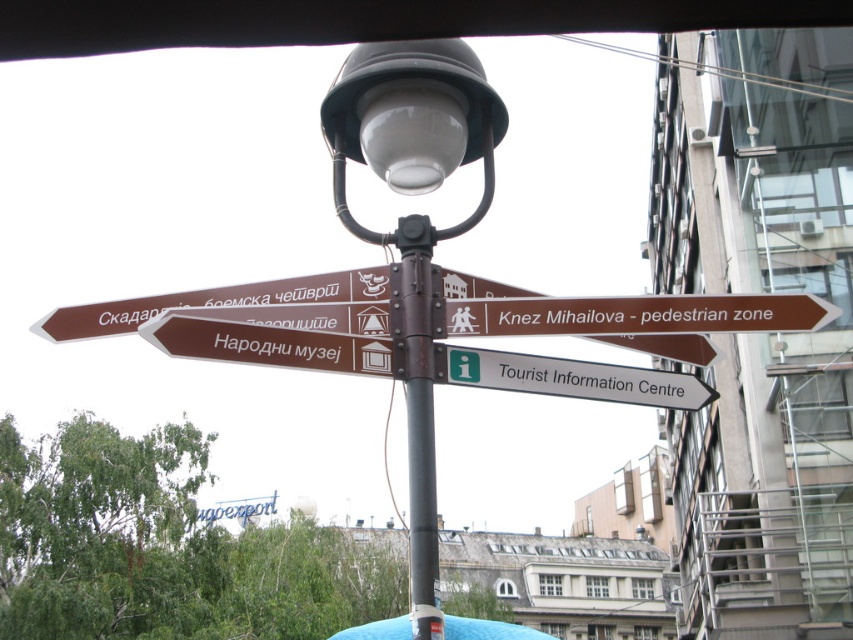
Between point (409, 216) and point (619, 381), which one is positioned behind?

Positioned behind is point (619, 381).

Who is more distant from viewer, (427, 253) or (573, 387)?

The point (573, 387) is behind.

Where is `brown metallic pole at center`? brown metallic pole at center is located at coordinates (421, 417).

What do you see at coordinates (415, 227) in the screenshot?
I see `matte black lamp post at center` at bounding box center [415, 227].

Can you confirm if matte black lamp post at center is shorter than white plastic sign at center?

In fact, matte black lamp post at center may be taller than white plastic sign at center.

Between point (459, 81) and point (646, 400), which one is positioned in front?

Point (459, 81) is more forward.

Find the location of a particular element. matte black lamp post at center is located at coordinates (415, 227).

Who is lower down, matte black lamp post at center or brown metallic pole at center?

brown metallic pole at center is below.

Is matte black lamp post at center taller than brown metallic pole at center?

Correct, matte black lamp post at center is much taller as brown metallic pole at center.

Locate an element on the screen. The image size is (853, 640). matte black lamp post at center is located at coordinates (415, 227).

The width and height of the screenshot is (853, 640). Identify the location of matte black lamp post at center. (415, 227).